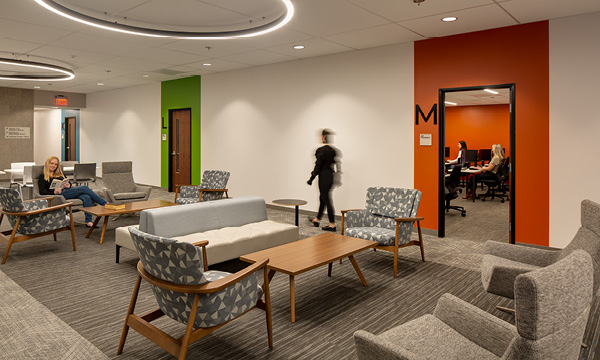
Where is `blue around door far left`? blue around door far left is located at coordinates (67, 115).